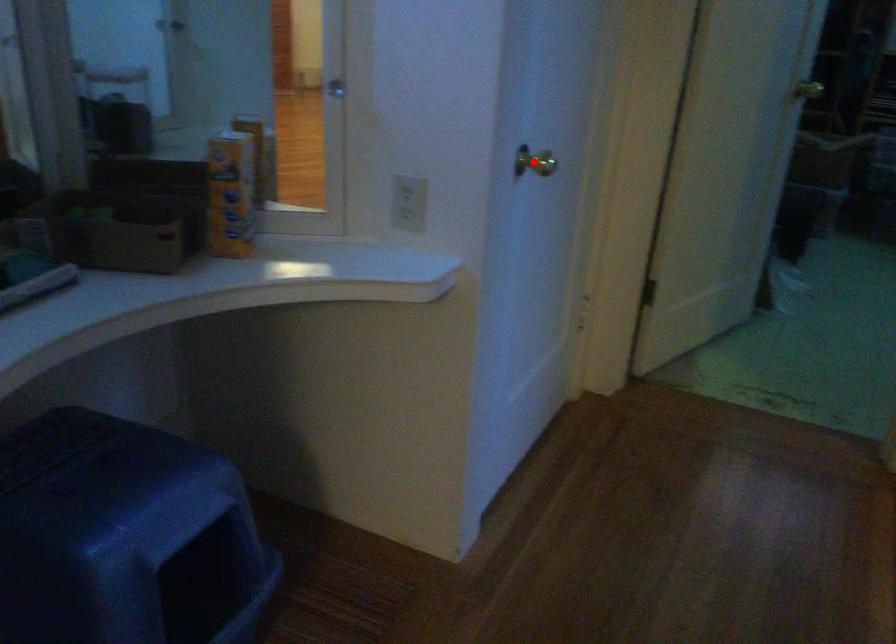
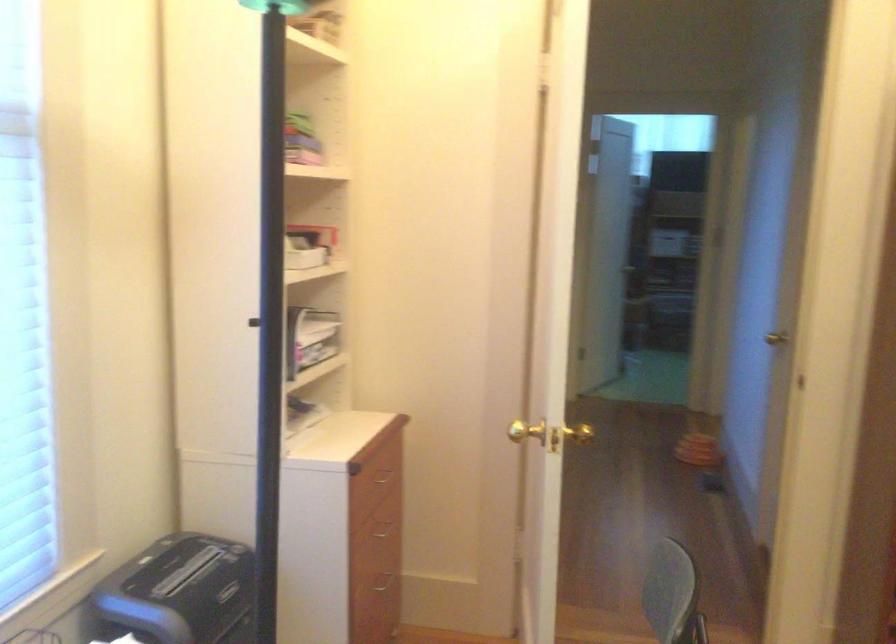
Question: I am providing you with two images of the same scene from different viewpoints. A red point is marked on the first image. Is the red point's position out of view in image 2?

Choices:
 (A) Yes
 (B) No

Answer: (A)